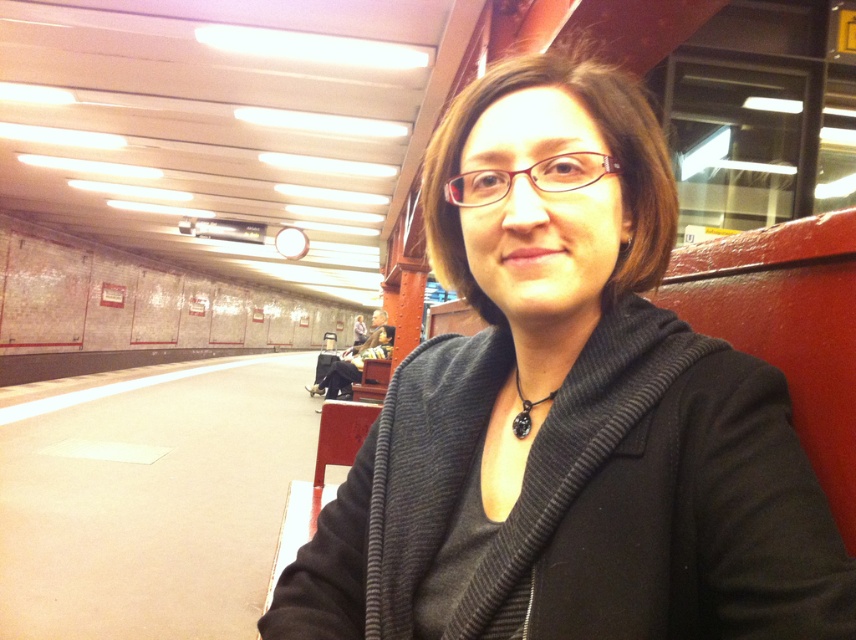
The height and width of the screenshot is (640, 856). What do you see at coordinates (568, 413) in the screenshot?
I see `black textured sweater at center` at bounding box center [568, 413].

Is black textured sweater at center above black leather pendant at center?

Indeed, black textured sweater at center is positioned over black leather pendant at center.

Describe the element at coordinates (568, 413) in the screenshot. I see `black textured sweater at center` at that location.

Identify the location of black textured sweater at center. This screenshot has height=640, width=856. (568, 413).